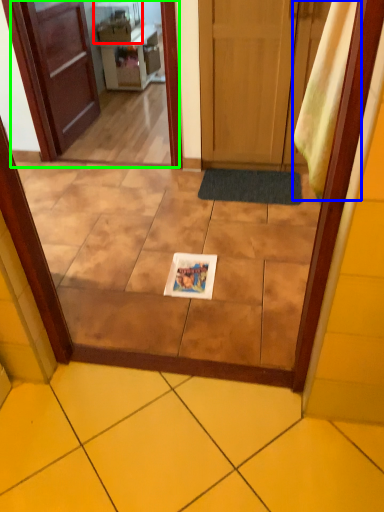
Question: Which object is the farthest from appliance (highlighted by a red box)? Choose among these: curtain (highlighted by a blue box) or screen door (highlighted by a green box).

Choices:
 (A) curtain
 (B) screen door

Answer: (A)